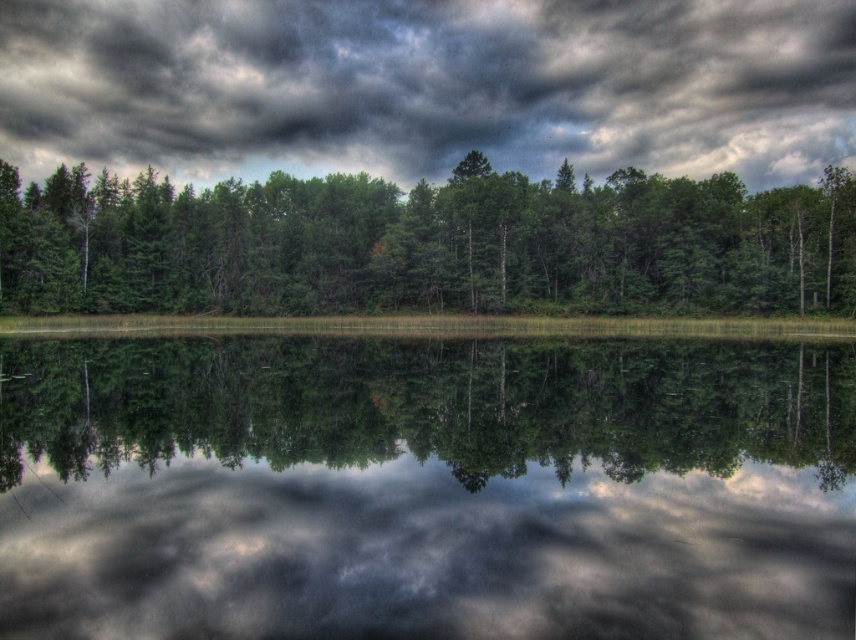
Question: Where is smooth reflective water at center located in relation to green matte forest at center in the image?

Choices:
 (A) above
 (B) below

Answer: (B)

Question: Observing the image, what is the correct spatial positioning of smooth reflective water at center in reference to dark gray textured clouds at upper center?

Choices:
 (A) right
 (B) left

Answer: (A)

Question: Is smooth reflective water at center wider than green matte forest at center?

Choices:
 (A) no
 (B) yes

Answer: (A)

Question: Which of the following is the closest to the observer?

Choices:
 (A) dark gray textured clouds at upper center
 (B) green matte forest at center

Answer: (B)

Question: Estimate the real-world distances between objects in this image. Which object is farther from the dark gray textured clouds at upper center?

Choices:
 (A) green matte forest at center
 (B) smooth reflective water at center

Answer: (B)

Question: Based on their relative distances, which object is farther from the smooth reflective water at center?

Choices:
 (A) green matte forest at center
 (B) dark gray textured clouds at upper center

Answer: (B)